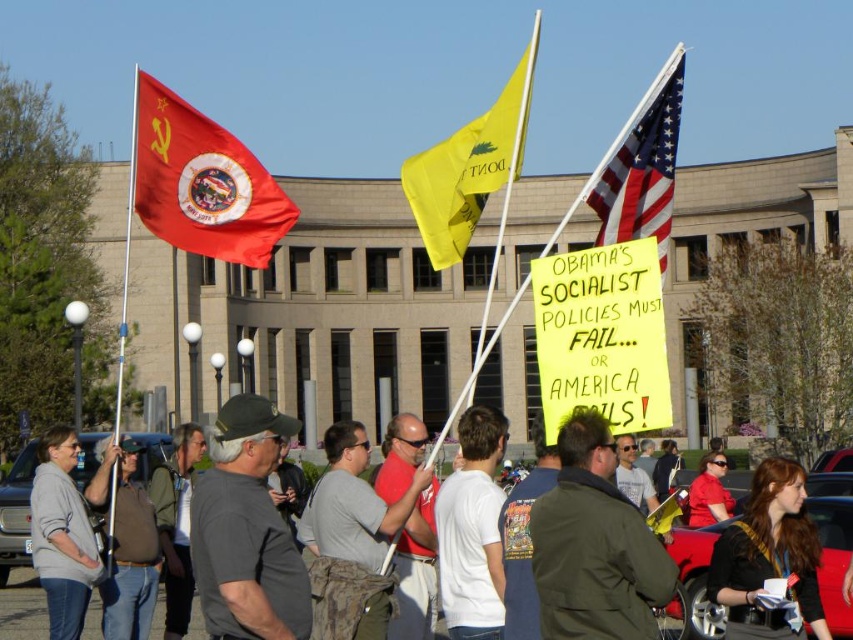
You are a photographer trying to capture the protest scene. You notice the dark brown leather jacket at lower right and the yellow fabric flag at center. Which object should you focus on to ensure it fits entirely within your camera frame if your frame can only accommodate objects up to the size of the smaller one?

The dark brown leather jacket at lower right is smaller than the yellow fabric flag at center. Therefore, to ensure it fits entirely within your camera frame, you should focus on the dark brown leather jacket at lower right.

You are a photographer trying to capture a wide shot of the protest scene. You notice the yellow fabric flag at center and the american flag at center. Which flag should you position closer to the edges of your camera frame to ensure both flags are fully visible in the photo?

The yellow fabric flag at center is wider than the american flag at center. To ensure both are fully visible, position the wider yellow fabric flag at center closer to the edges of the frame so it doesn

You are a photographer standing at the center of the protest scene. You want to take a photo of the dark brown leather jacket at lower right. Based on its position, where should you aim your camera relative to your current position?

The dark brown leather jacket at lower right is located at point 0.875 on the x axis and 0.903 on the y axis, so you should aim your camera to the lower right direction from your current position.